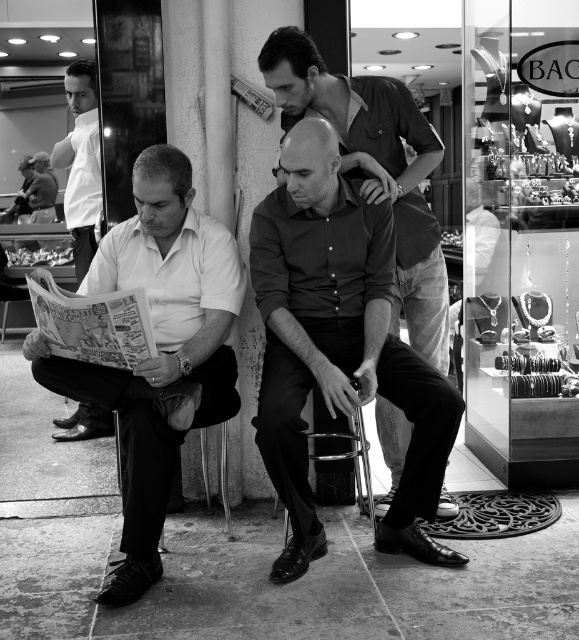
Question: Is smooth black shirt at center closer to the viewer compared to white shirt at left?

Choices:
 (A) yes
 (B) no

Answer: (A)

Question: Does smooth black shirt at center have a greater width compared to metallic silver chair at center?

Choices:
 (A) no
 (B) yes

Answer: (B)

Question: Which point is closer to the camera taking this photo?

Choices:
 (A) (376, 323)
 (B) (353, 476)

Answer: (A)

Question: Is matte white shirt at left to the right of white shirt at left from the viewer's perspective?

Choices:
 (A) no
 (B) yes

Answer: (B)

Question: Which of the following is the closest to the observer?

Choices:
 (A) (221, 276)
 (B) (329, 497)
 (C) (89, 429)
 (D) (336, 269)

Answer: (D)

Question: Estimate the real-world distances between objects in this image. Which object is farther from the metallic silver chair at center?

Choices:
 (A) smooth black shirt at center
 (B) white shirt at left

Answer: (B)